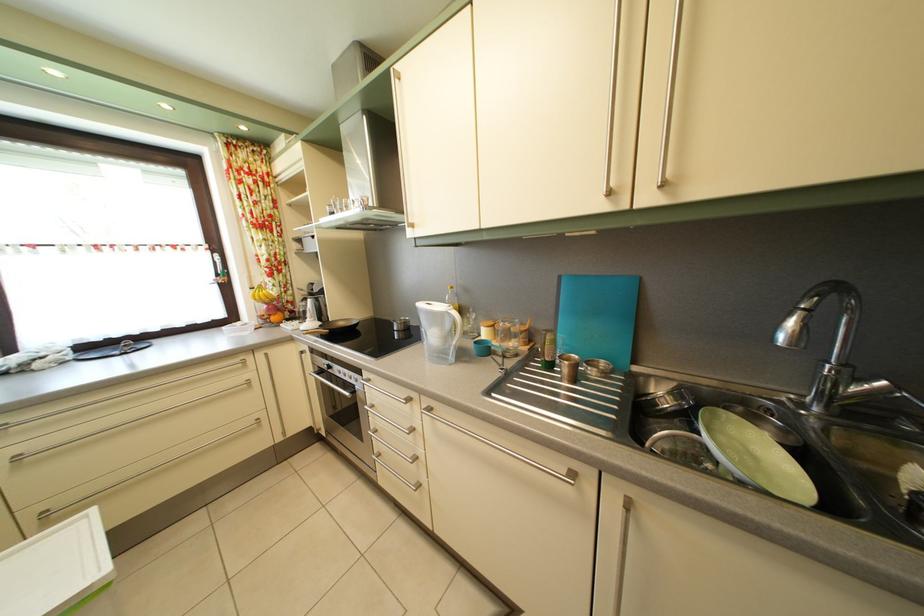
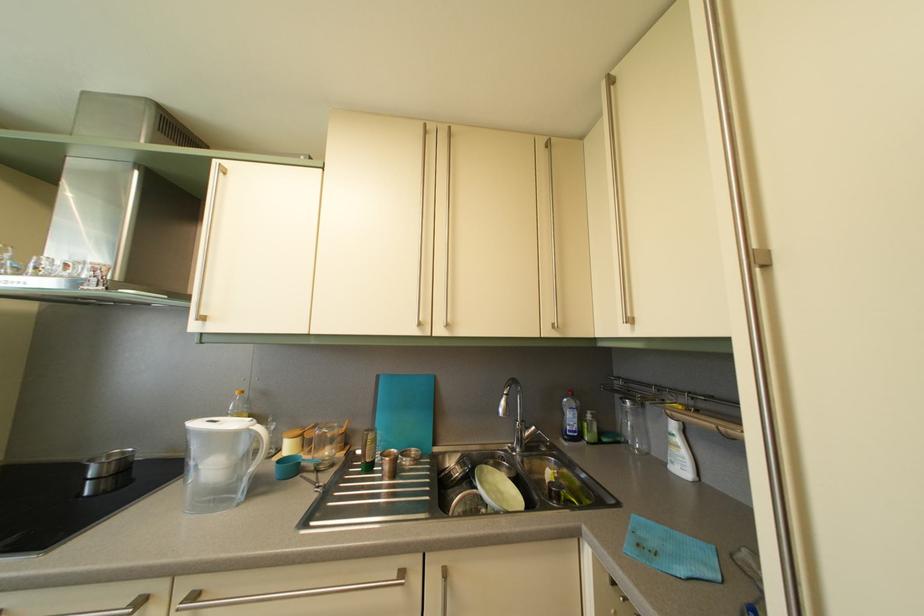
Where in the second image is the point corresponding to point (481, 323) from the first image?

(282, 435)